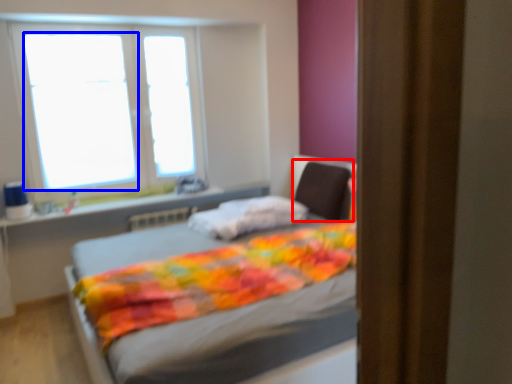
Question: Among these objects, which one is nearest to the camera, swivel chair (highlighted by a red box) or window screen (highlighted by a blue box)?

Choices:
 (A) swivel chair
 (B) window screen

Answer: (A)